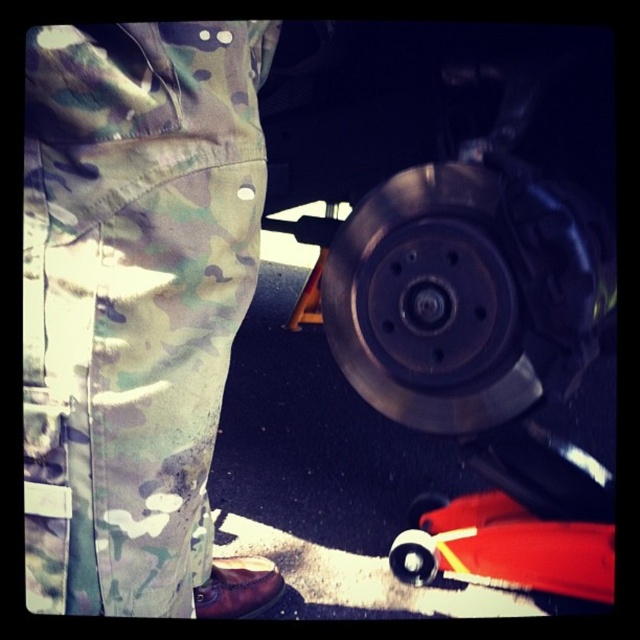
You are a mechanic working on a vehicle. You need to reach a point located at coordinates point (49, 576). Your arm can extend 14 inches. Can you reach that point?

The distance between point (49, 576) and the viewer is 14.95 inches. Since your arm can only extend 14 inches, you cannot reach that point.

You are a child playing in the garage and see the rubberized red toy car at lower right and the metallic silver wheel at lower center. Which object is closer to the right side of the garage?

The rubberized red toy car at lower right is closer to the right side of the garage because it is positioned to the right of the metallic silver wheel at lower center.

You are a mechanic working on a vehicle. You need to place a rubberized red toy car at lower right on top of the metallic brake disc at lower right. Will the toy car fit entirely on the brake disc?

The metallic brake disc at lower right is larger in size than the rubberized red toy car at lower right, so the toy car will fit entirely on the brake disc.